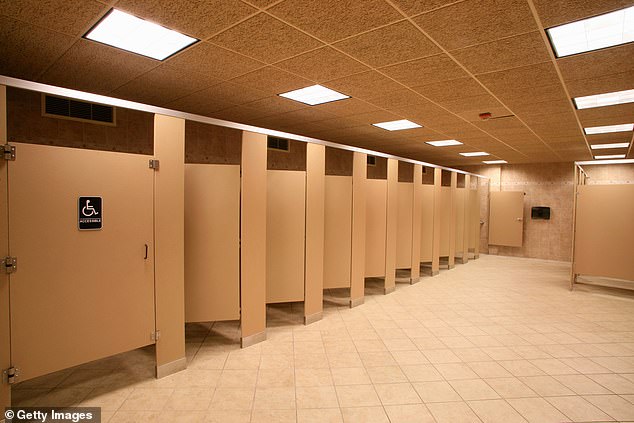
Find the location of a particular element. The image size is (634, 423). frame above stalls is located at coordinates (127, 106).